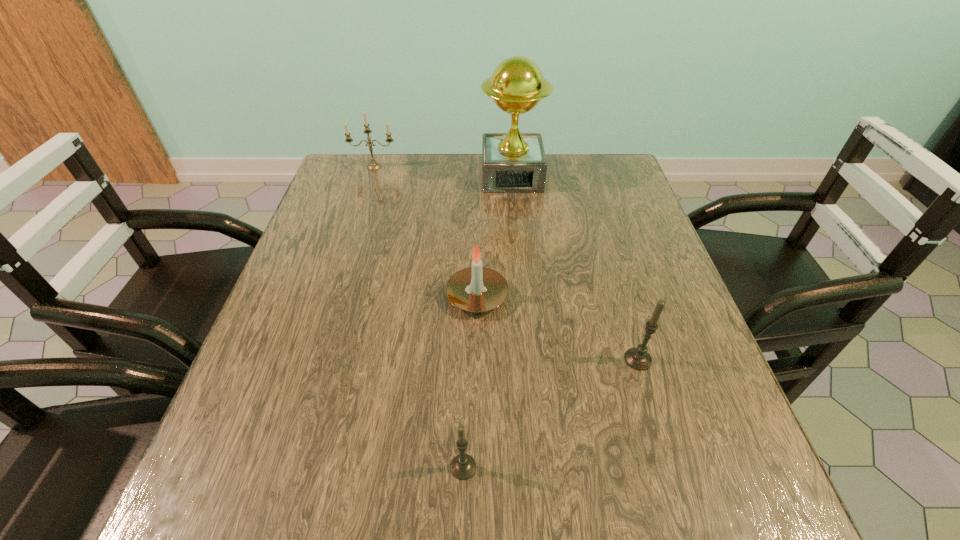
At what (x,y) coordinates should I click in order to perform the action: click on free spot between the third farthest object and the second nearest candle. Please return your answer as a coordinate pair (x, y). The image size is (960, 540). Looking at the image, I should click on (558, 328).

Find the location of `vacant space that is in between the third nearest candle and the farthest candle`. vacant space that is in between the third nearest candle and the farthest candle is located at coordinates (426, 232).

The image size is (960, 540). Identify the location of vacant area that lies between the third nearest candle and the nearest object. (470, 382).

At what (x,y) coordinates should I click in order to perform the action: click on free space between the rightmost candle and the leftmost candle. Please return your answer as a coordinate pair (x, y). Looking at the image, I should click on tap(506, 263).

Where is `free point between the third farthest object and the nearest object`? Image resolution: width=960 pixels, height=540 pixels. free point between the third farthest object and the nearest object is located at coordinates (470, 382).

This screenshot has height=540, width=960. What are the coordinates of `the second closest object to the second farthest candle` in the screenshot? It's located at (463, 466).

Choose which object is the second nearest neighbor to the tallest object. Please provide its 2D coordinates. Your answer should be formatted as a tuple, i.e. [(x, y)], where the tuple contains the x and y coordinates of a point satisfying the conditions above.

[(474, 289)]

This screenshot has width=960, height=540. I want to click on candle that is the second nearest to the farthest candle, so click(638, 358).

I want to click on candle that is the third closest to the rightmost candle, so click(373, 166).

The height and width of the screenshot is (540, 960). In order to click on free region that satisfies the following two spatial constraints: 1. on the front side of the farthest candle; 2. on the right side of the third nearest object in this screenshot , I will do `click(333, 296)`.